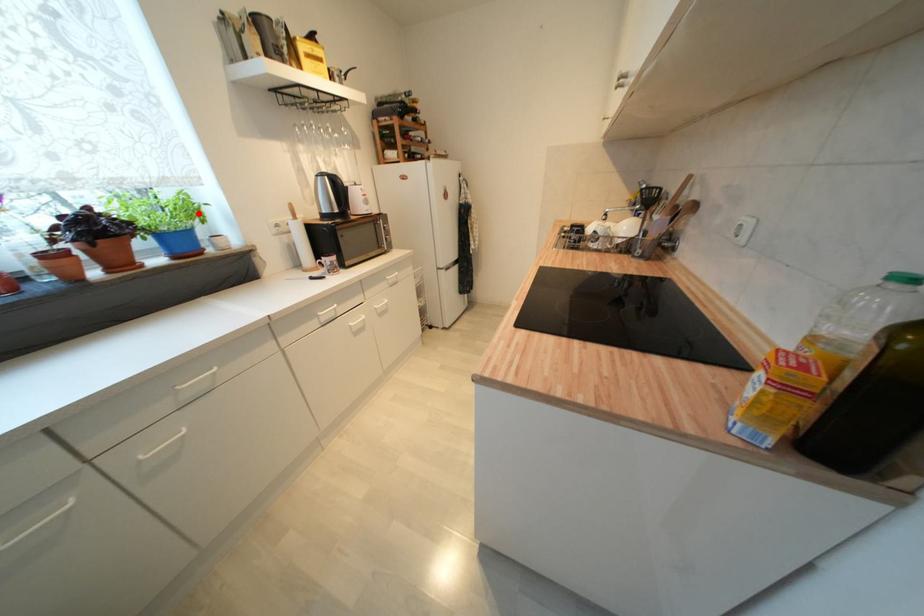
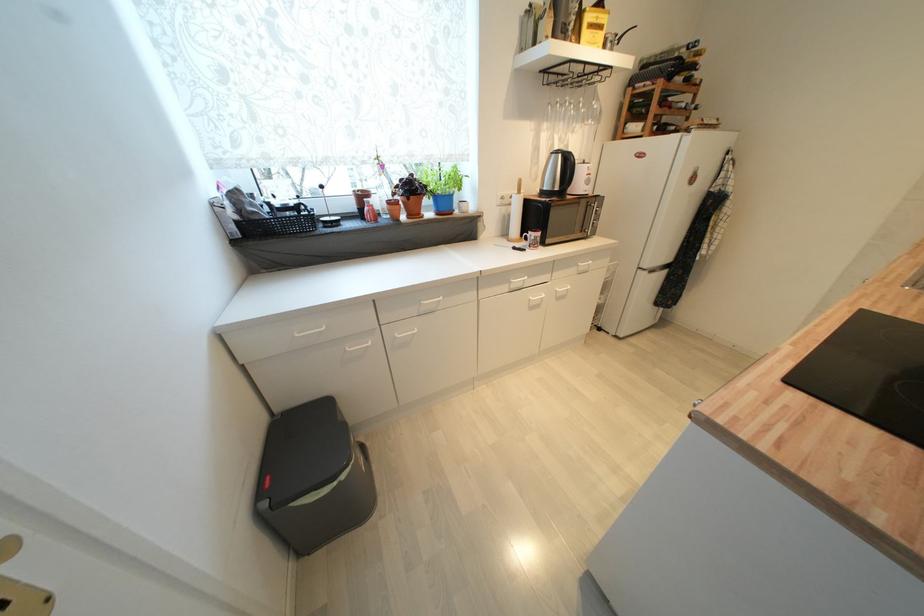
Locate, in the second image, the point that corresponds to the highlighted location in the first image.

(463, 184)